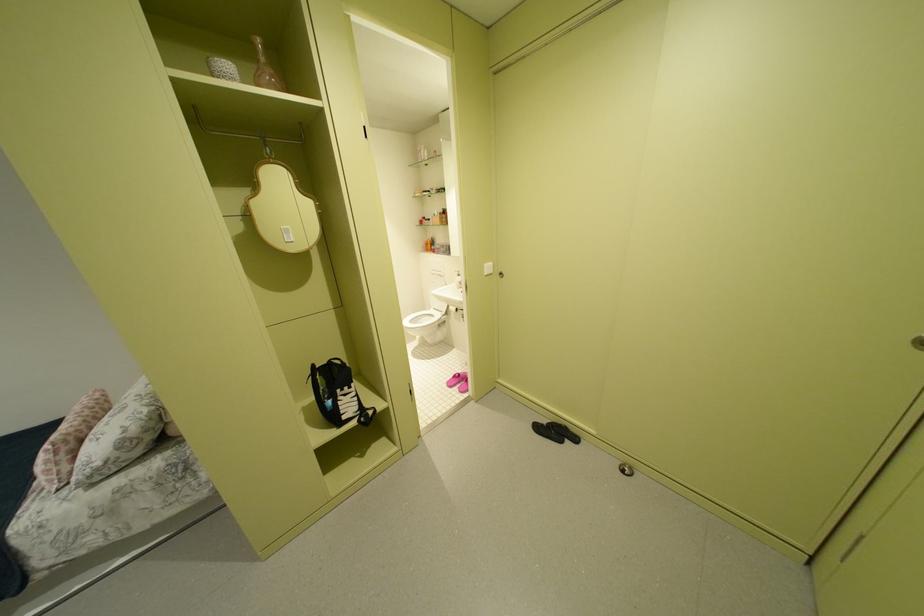
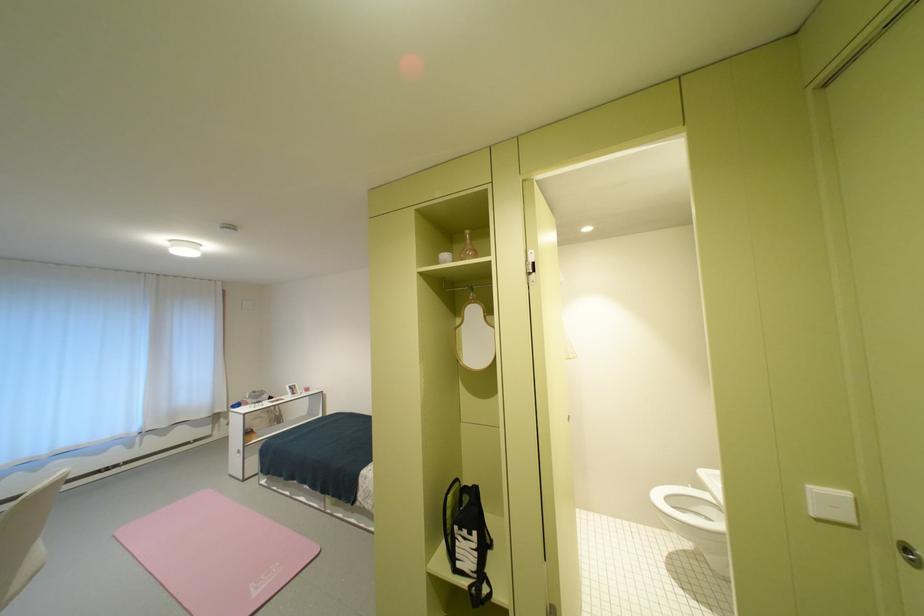
The point at (511,275) is marked in the first image. Where is the corresponding point in the second image?

(917, 551)